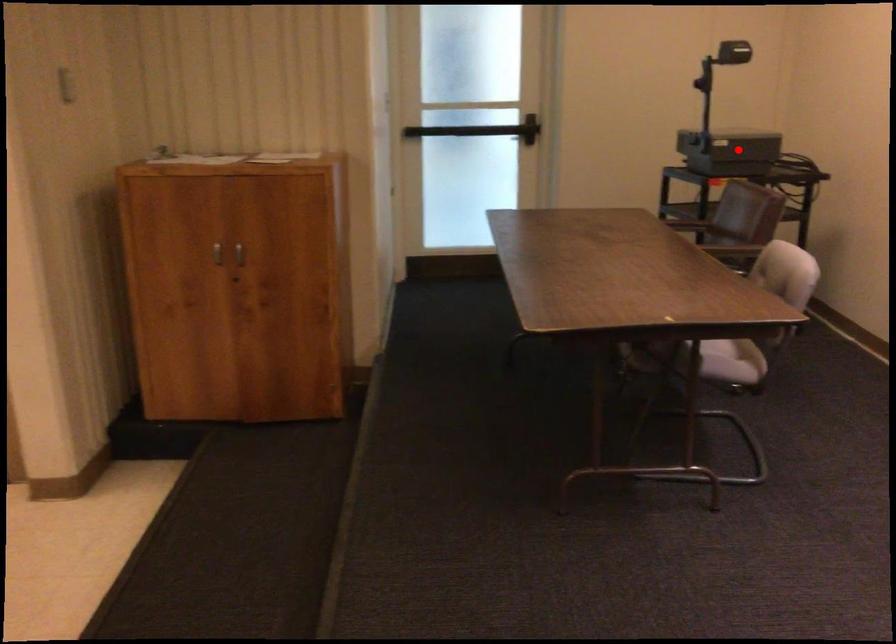
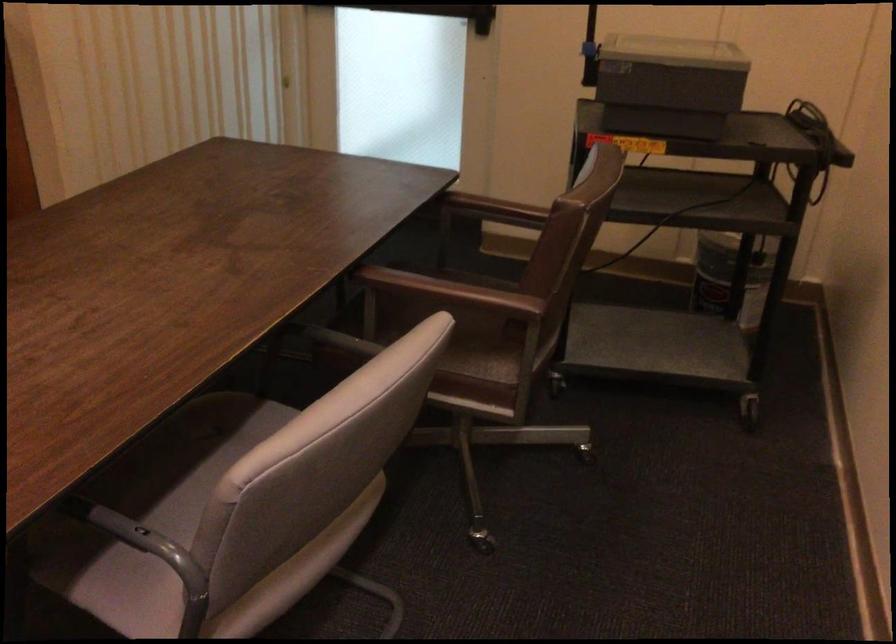
Question: A red point is marked in image1. In image2, is the corresponding 3D point closer to the camera or farther? Reply with the corresponding letter.

Choices:
 (A) The corresponding 3D point is closer.
 (B) The corresponding 3D point is farther.

Answer: (A)